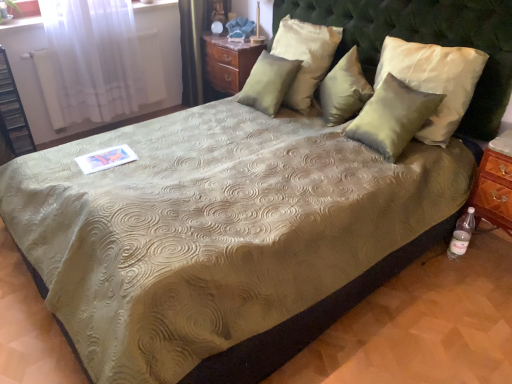
Question: Are black plastic shelf at left and satin green pillow at center, positioned as the third pillow in left-to-right order, located far from each other?

Choices:
 (A) yes
 (B) no

Answer: (A)

Question: From a real-world perspective, is black plastic shelf at left positioned under satin green pillow at center, arranged as the second pillow when viewed from the right, based on gravity?

Choices:
 (A) no
 (B) yes

Answer: (B)

Question: Can we say black plastic shelf at left lies outside satin green pillow at center, arranged as the second pillow when viewed from the right?

Choices:
 (A) yes
 (B) no

Answer: (A)

Question: Is black plastic shelf at left closer to the viewer compared to satin green pillow at center, positioned as the third pillow in left-to-right order?

Choices:
 (A) no
 (B) yes

Answer: (A)

Question: Is black plastic shelf at left positioned with its back to satin green pillow at center, arranged as the second pillow when viewed from the right?

Choices:
 (A) no
 (B) yes

Answer: (A)

Question: Is black plastic shelf at left at the right side of satin green pillow at center, positioned as the third pillow in left-to-right order?

Choices:
 (A) yes
 (B) no

Answer: (B)

Question: Are satin white pillow at upper center, which is the 2th pillow in left-to-right order, and green tufted headboard at upper center beside each other?

Choices:
 (A) yes
 (B) no

Answer: (B)

Question: From a real-world perspective, is satin white pillow at upper center, which is the 2th pillow in left-to-right order, positioned under green tufted headboard at upper center based on gravity?

Choices:
 (A) yes
 (B) no

Answer: (A)

Question: Is satin white pillow at upper center, which is the 2th pillow in left-to-right order, bigger than green tufted headboard at upper center?

Choices:
 (A) no
 (B) yes

Answer: (A)

Question: Is there a large distance between satin white pillow at upper center, which is the 2th pillow in left-to-right order, and green tufted headboard at upper center?

Choices:
 (A) no
 (B) yes

Answer: (A)

Question: Does satin white pillow at upper center, which is the 2th pillow in left-to-right order, come in front of green tufted headboard at upper center?

Choices:
 (A) yes
 (B) no

Answer: (B)

Question: Considering the relative sizes of satin white pillow at upper center, placed as the 3th pillow when sorted from right to left, and green tufted headboard at upper center in the image provided, is satin white pillow at upper center, placed as the 3th pillow when sorted from right to left, wider than green tufted headboard at upper center?

Choices:
 (A) no
 (B) yes

Answer: (A)

Question: Considering the relative sizes of satin green pillow at upper right, which is counted as the 4th pillow, starting from the left, and wooden nightstand at upper center in the image provided, is satin green pillow at upper right, which is counted as the 4th pillow, starting from the left, wider than wooden nightstand at upper center?

Choices:
 (A) no
 (B) yes

Answer: (A)